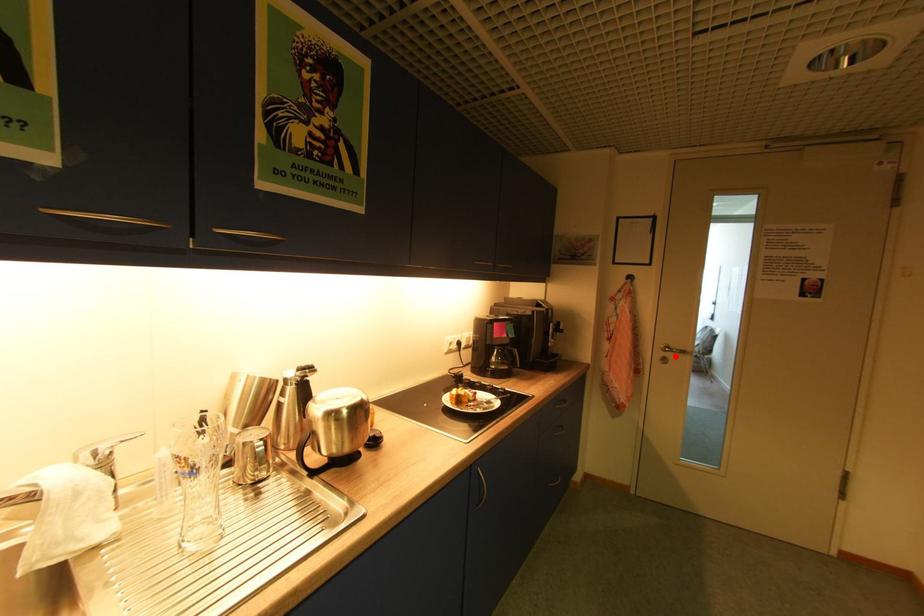
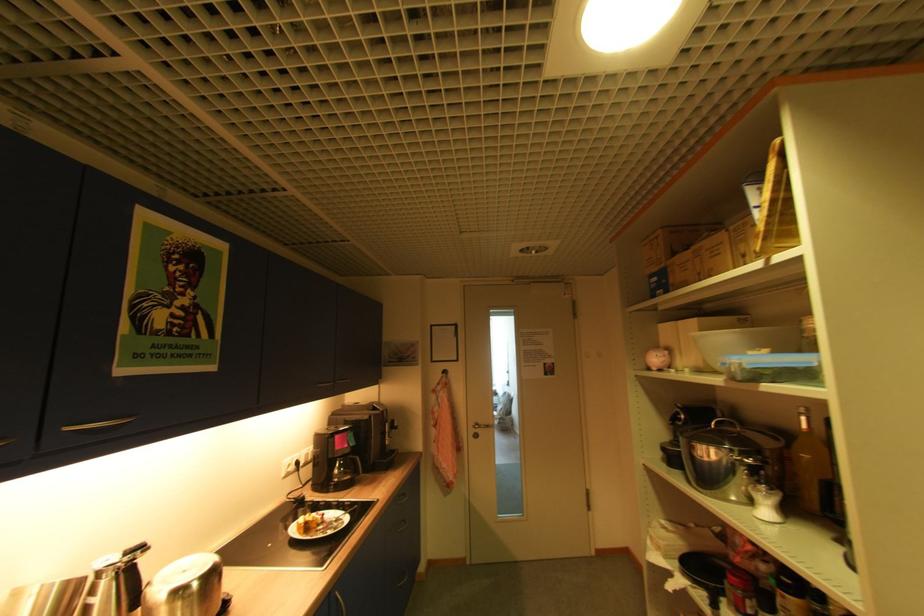
Find the pixel in the second image that matches the highlighted location in the first image.

(484, 431)